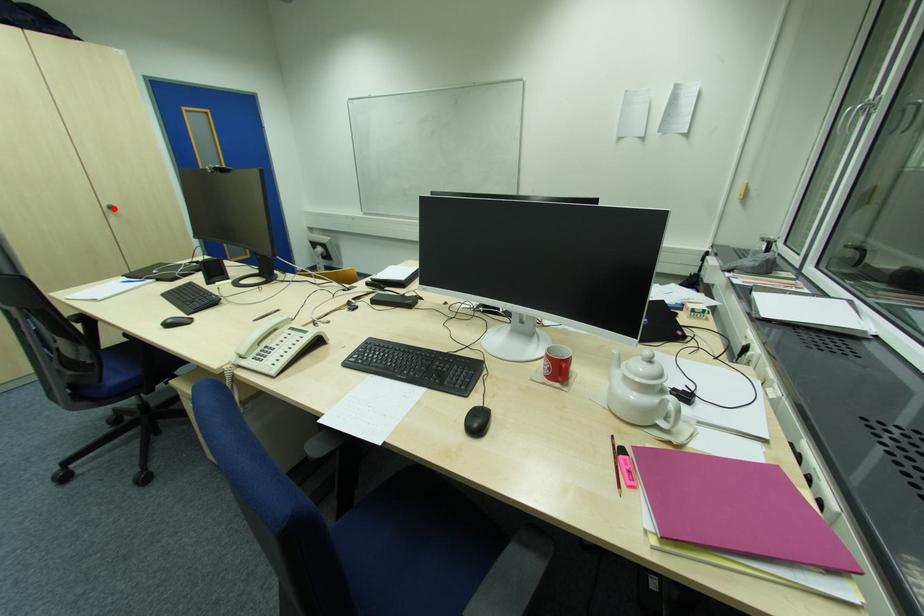
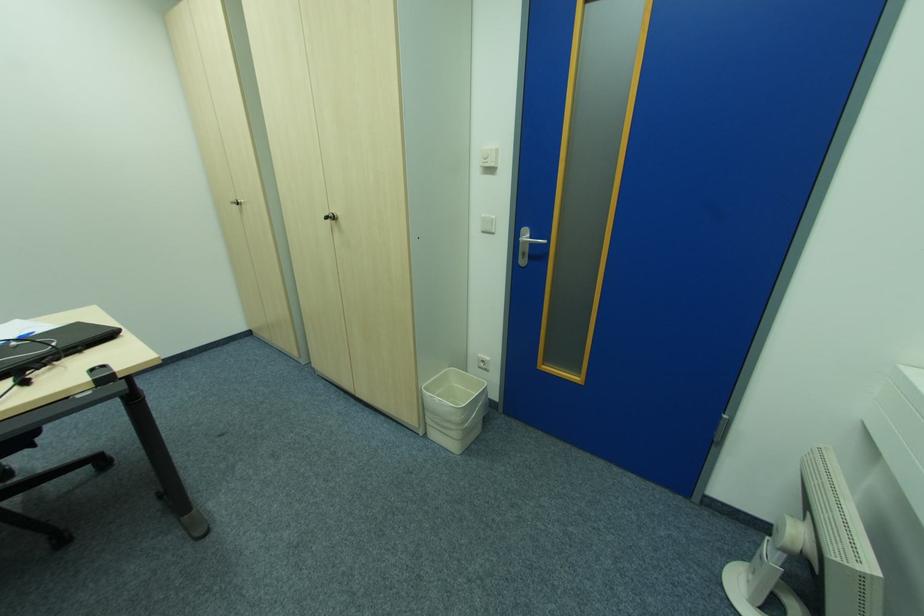
In the second image, find the point that corresponds to the highlighted location in the first image.

(334, 219)